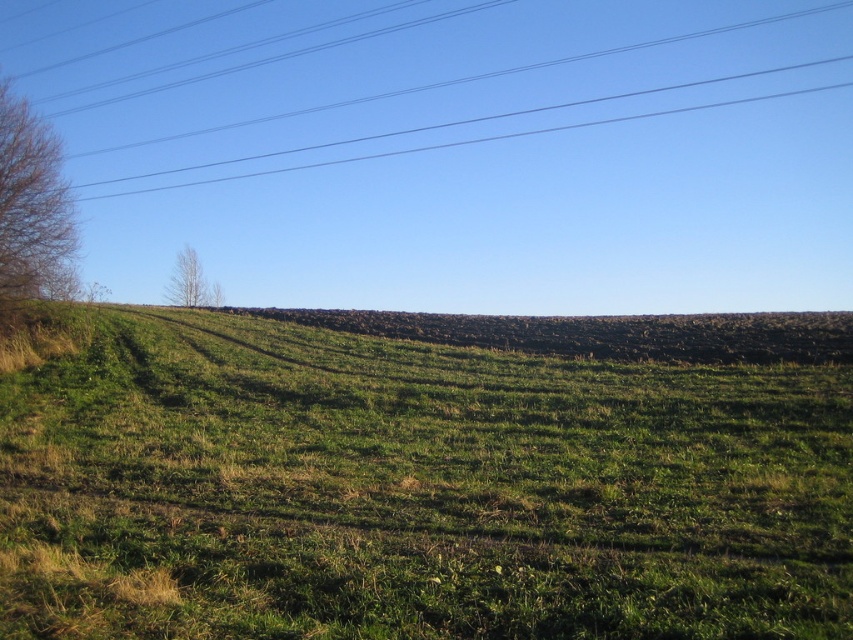
You are a landscape architect analyzing the rural scene. You need to determine which area is wider between the green grassy field at center and the green leafy tree at upper left. Which one is wider?

The green grassy field at center is wider than the green leafy tree at upper left according to the description.

You are a bird trying to land on the metallic wires at upper center and the bare branches at left. Which one do you think has a larger surface area to perch on?

The metallic wires at upper center might be wider than bare branches at left, so the metallic wires at upper center likely provide a larger surface area for perching.

You are standing at the center of the image. Which direction should you look to see the bare branches at left?

The bare branches at left are located at the left side of the image, so you should look to your left to see them.